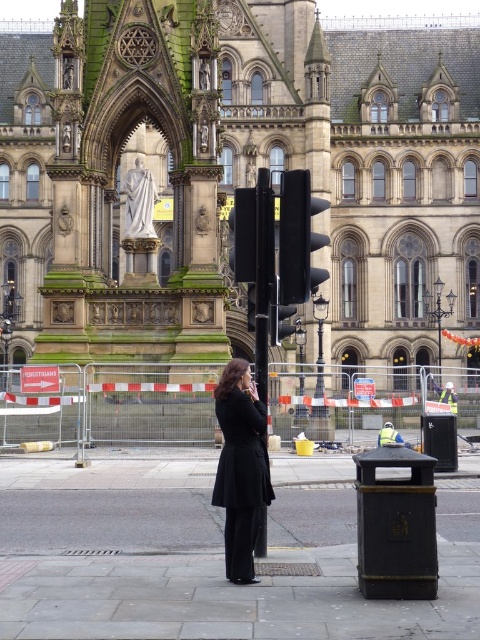
You are a delivery person trying to secure a package on a 1.2 meter wide cart. The cart is parked between the black glossy pole at center and the black glass traffic light at center. Can the cart fit between them?

The black glossy pole at center is bigger than the black glass traffic light at center, but without knowing the exact distance between them, we can only confirm their size comparison. The cart may or may not fit depending on the space available between the two objects.

You are standing at the point labeled as point (297, 196) in front of a historic Gothic building with a statue in the central archway. You want to walk towards the building entrance. Can you estimate how far you need to walk to reach the building?

The distance between point (297, 196) and the viewer is 50.22 meters, so you need to walk approximately 50.22 meters to reach the building entrance.

You are a pedestrian standing in front of the grand historic building. You notice a black wool coat at center and a black matte traffic light at center. Which object is closer to you?

The black wool coat at center is closer to you because it has a smaller size compared to the black matte traffic light at center, indicating it is nearer.